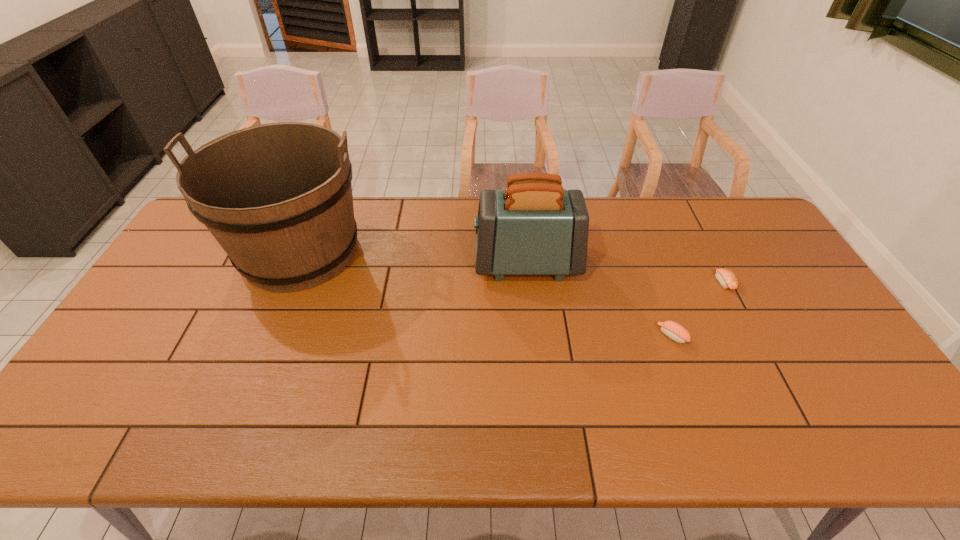
Locate an element on the screen. free space that satisfies the following two spatial constraints: 1. on the back side of the nearest object; 2. on the front-facing side of the toaster is located at coordinates (645, 263).

Find the location of a particular element. The width and height of the screenshot is (960, 540). free location that satisfies the following two spatial constraints: 1. on the front-facing side of the third object from left to right; 2. on the right side of the third object from right to left is located at coordinates (535, 336).

Locate an element on the screen. blank area in the image that satisfies the following two spatial constraints: 1. on the front-facing side of the second object from left to right; 2. on the left side of the farther sushi is located at coordinates (529, 282).

This screenshot has width=960, height=540. Identify the location of vacant space that satisfies the following two spatial constraints: 1. on the front-facing side of the right sushi; 2. on the right side of the second tallest object. (529, 282).

Identify the location of free space in the image that satisfies the following two spatial constraints: 1. on the front-facing side of the second tallest object; 2. on the left side of the rightmost object. The height and width of the screenshot is (540, 960). (529, 282).